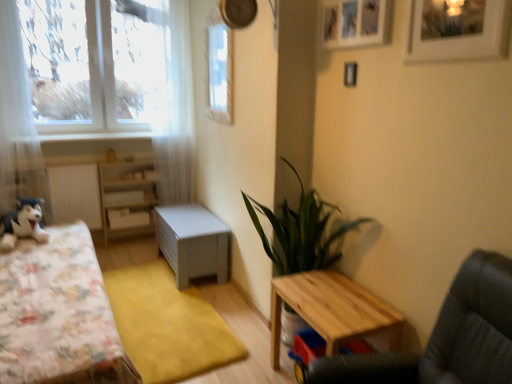
This screenshot has width=512, height=384. I want to click on free point above white matte drawer at center (from a real-world perspective), so click(x=130, y=207).